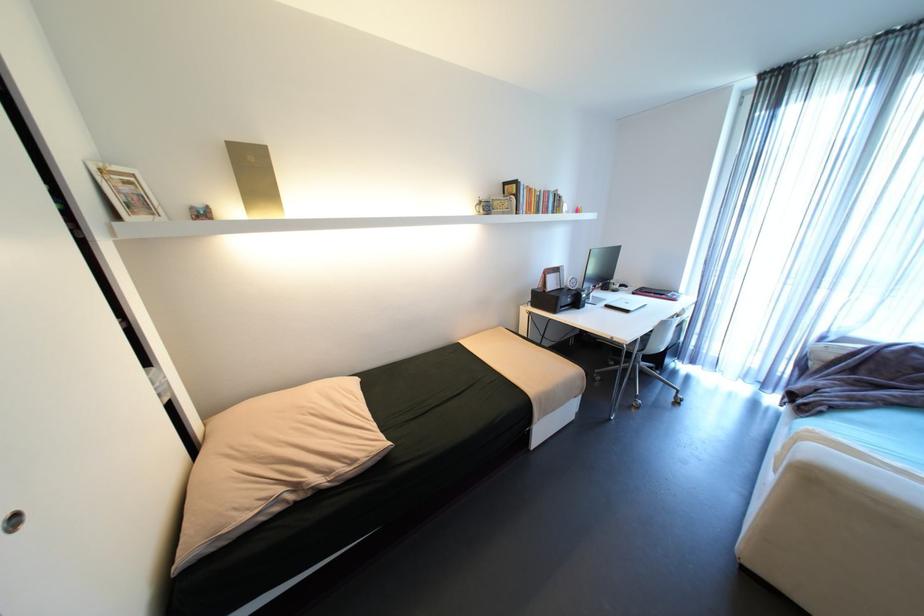
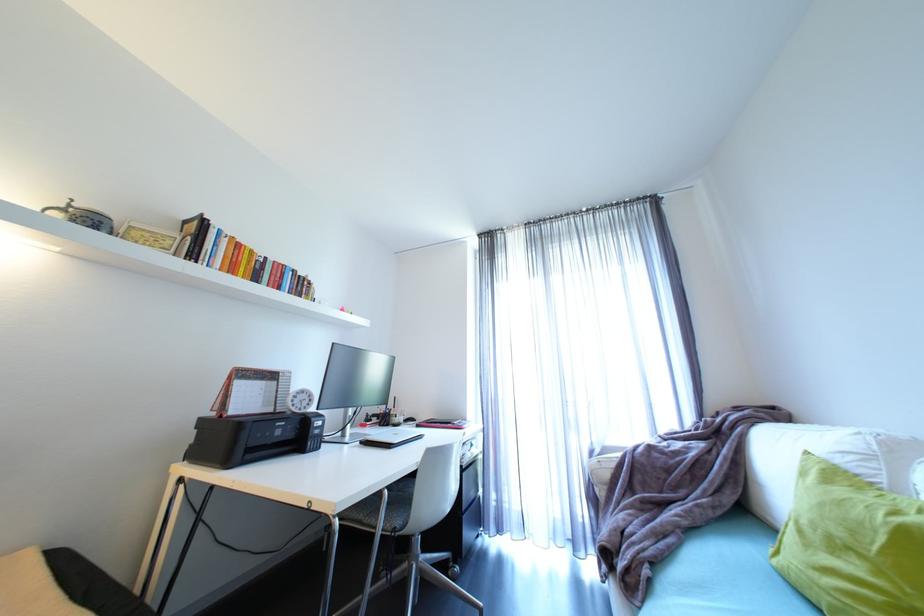
Find the pixel in the second image that matches [631,346] in the first image.

(344, 522)